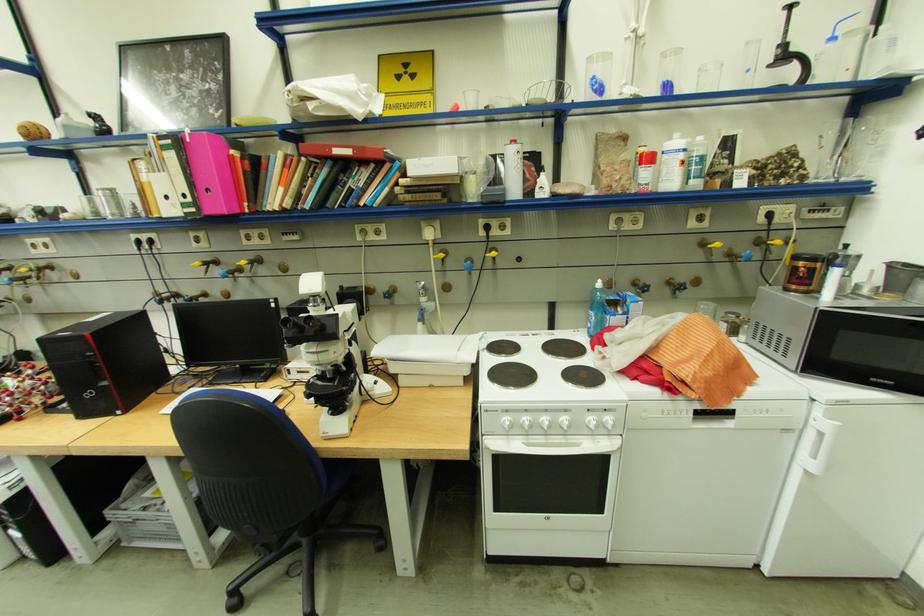
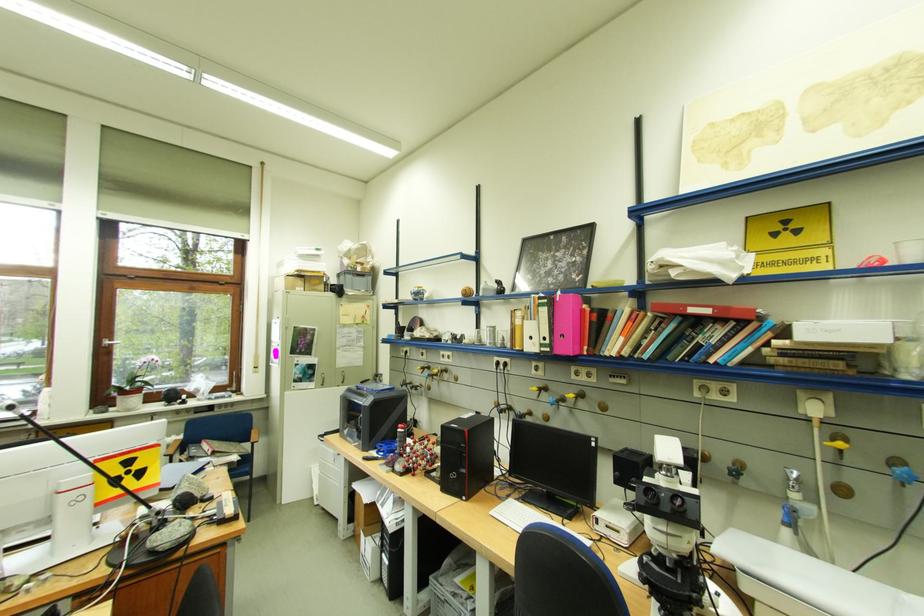
Where in the second image is the point corresponding to (x=275, y=382) from the first image?

(580, 521)